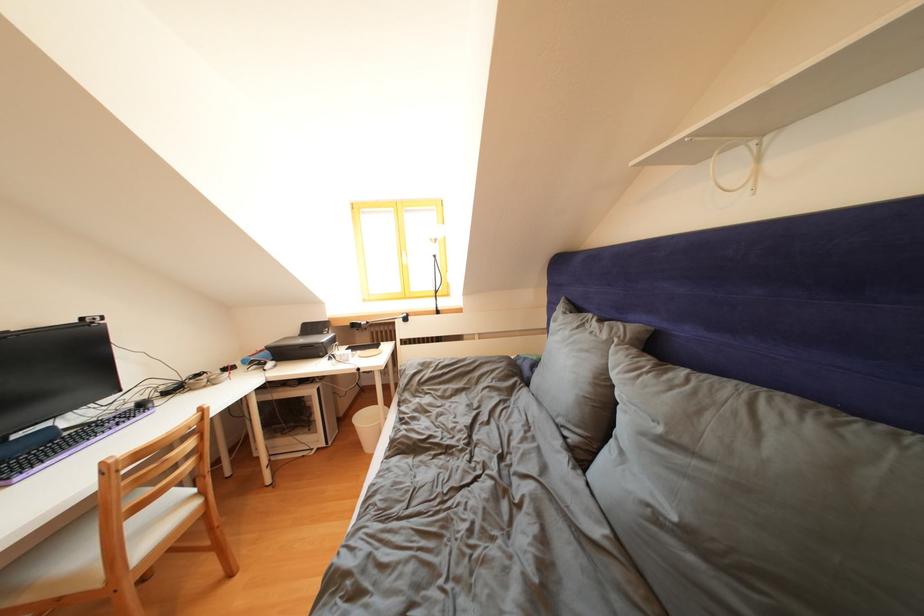
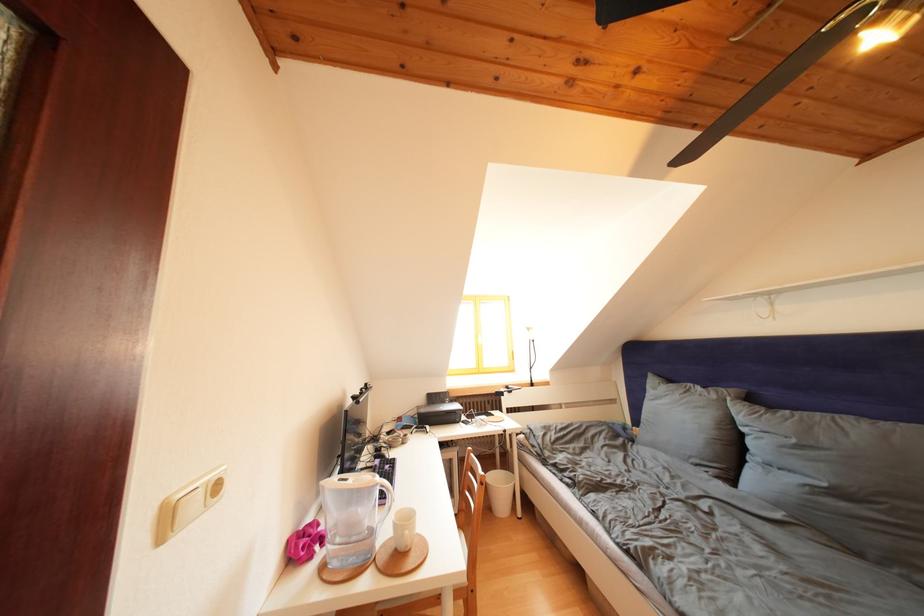
Locate, in the second image, the point that corresponds to point 667,435 in the first image.

(801, 446)